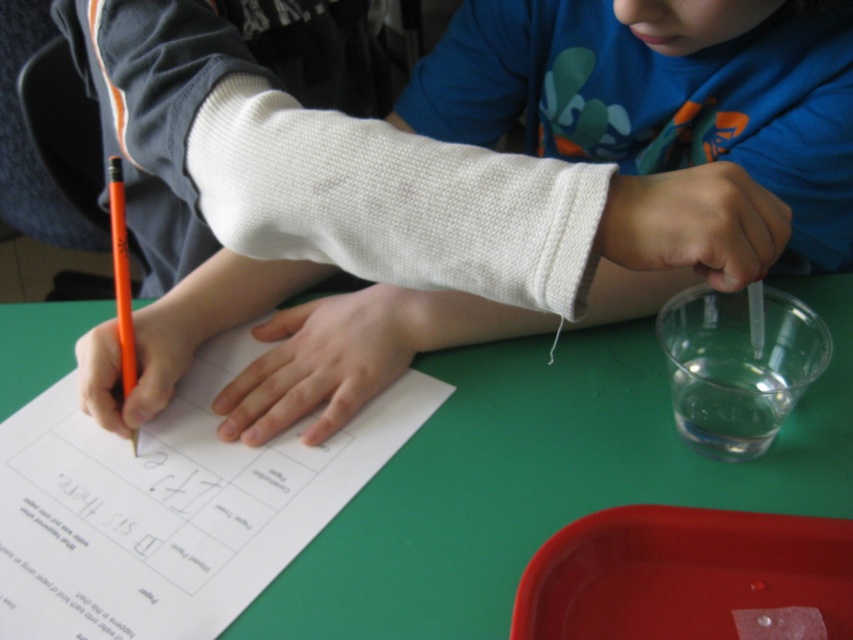
You are a nurse checking the child at the table. You need to place a new bandage on the white knitted cast at upper center and the orange matte pencil at left. Which object requires a larger bandage size?

The white knitted cast at upper center requires a larger bandage size since its width is greater than the orange matte pencil at left.

You are a teacher observing a child at a table. The child is using their right hand to hold an orange pencil while their left hand is bandaged. You need to place a new set of pencils on the table so they can reach them easily. Where should you place the new pencils relative to the green matte table at center and the transparent plastic cup at right?

The green matte table at center is positioned on the left side of the transparent plastic cup at right, so you should place the new pencils between the green matte table at center and the transparent plastic cup at right to ensure the child can easily reach them with their right hand.

You are a photographer taking a picture of the scene. You notice two points in the image at coordinates point (395, 356) and point (112, 180). Which point will appear closer to the camera in the photo?

Point (112, 180) will appear closer to the camera because it is closer to the photographer than point (395, 356), which is further away.